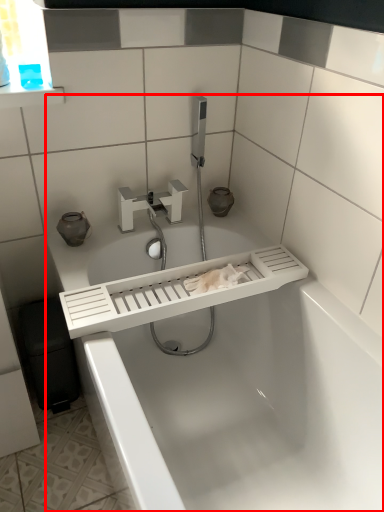
Question: Considering the relative positions of bathtub (annotated by the red box) and tap in the image provided, where is bathtub (annotated by the red box) located with respect to the staircase?

Choices:
 (A) left
 (B) right

Answer: (B)